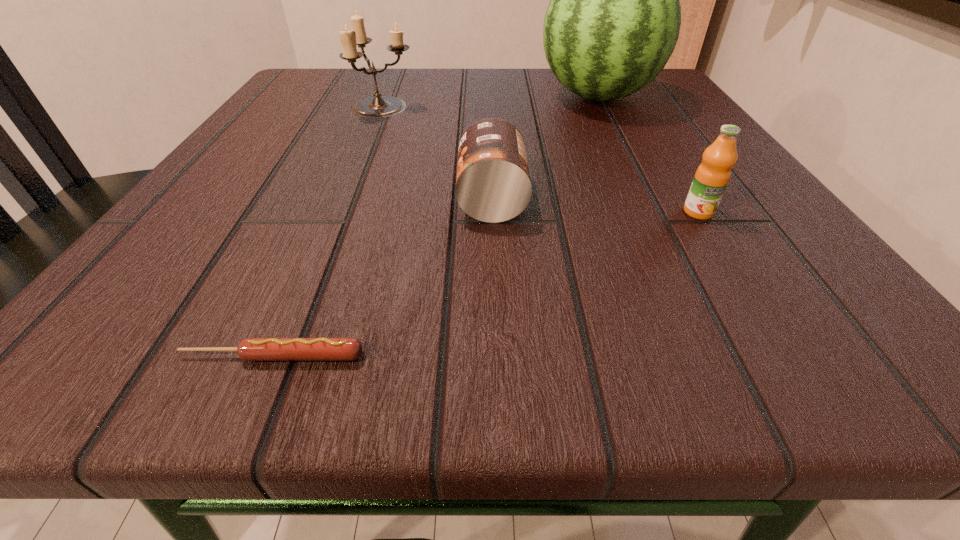
Find the location of a particular element. The width and height of the screenshot is (960, 540). watermelon is located at coordinates (613, 21).

At what (x,y) coordinates should I click in order to perform the action: click on candle holder. Please return your answer as a coordinate pair (x, y). Looking at the image, I should click on (379, 106).

Identify the location of the third tallest object. The width and height of the screenshot is (960, 540). (712, 176).

Find the location of a particular element. can is located at coordinates (493, 184).

Identify the location of the fourth tallest object. (493, 184).

Locate an element on the screen. the nearest object is located at coordinates (250, 349).

Identify the location of sausage. Image resolution: width=960 pixels, height=540 pixels. (250, 349).

Find the location of a particular element. vacant region located 0.300m on the front of the tallest object is located at coordinates (665, 230).

Where is `vacant region located 0.070m on the left of the candle holder`? vacant region located 0.070m on the left of the candle holder is located at coordinates (313, 106).

Image resolution: width=960 pixels, height=540 pixels. What are the coordinates of `vacant space situated 0.160m on the label of the orange juice` in the screenshot? It's located at (766, 319).